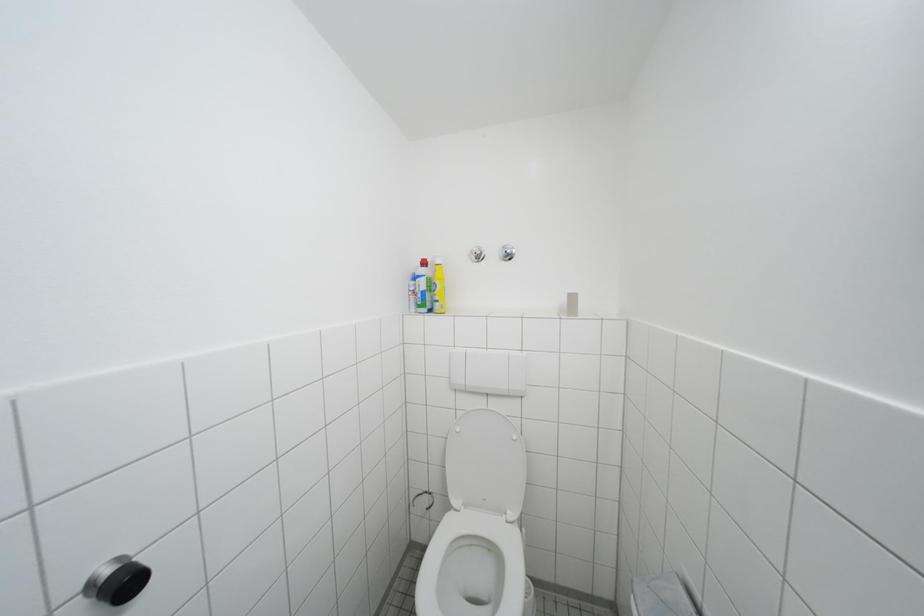
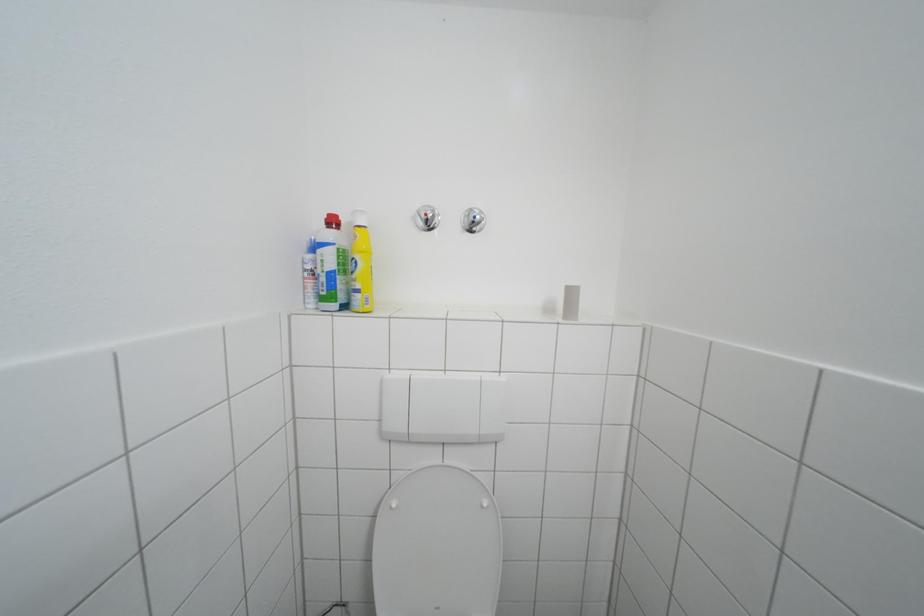
Question: The images are taken continuously from a first-person perspective. In which direction is your viewpoint rotating?

Choices:
 (A) Left
 (B) Right
 (C) Up
 (D) Down

Answer: (B)